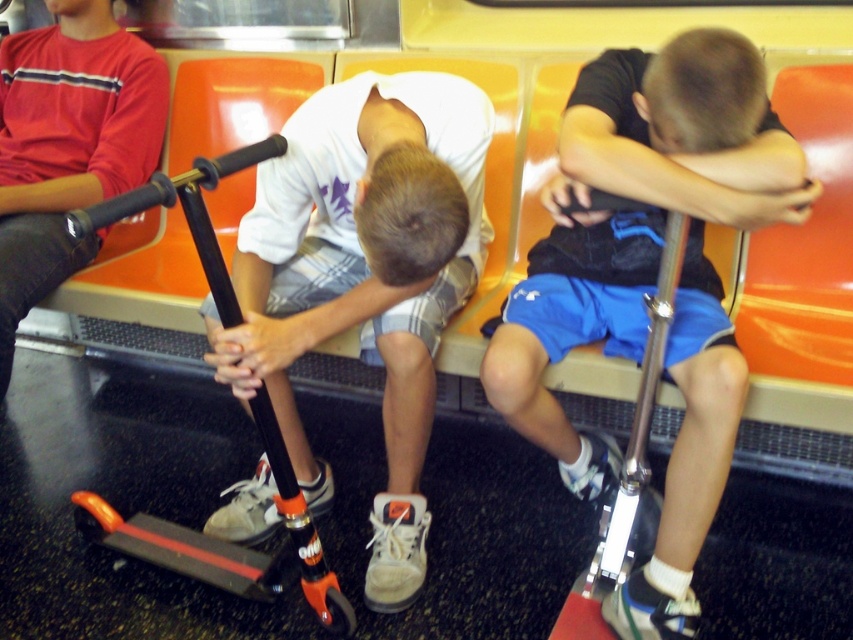
Question: Which object is the farthest from the orange matte scooter at center?

Choices:
 (A) white matte shirt at center
 (B) matte black scooter at center

Answer: (B)

Question: Is matte black scooter at center to the left of matte black scooter at lower left from the viewer's perspective?

Choices:
 (A) yes
 (B) no

Answer: (B)

Question: Is matte black scooter at center wider than white matte shirt at center?

Choices:
 (A) yes
 (B) no

Answer: (B)

Question: Is white matte shirt at center bigger than matte black scooter at lower left?

Choices:
 (A) no
 (B) yes

Answer: (B)

Question: Which of the following is the closest to the observer?

Choices:
 (A) orange matte scooter at center
 (B) matte black scooter at center
 (C) white matte shirt at center

Answer: (A)

Question: Which of the following is the closest to the observer?

Choices:
 (A) (631, 611)
 (B) (241, 564)
 (C) (55, 104)
 (D) (396, 544)

Answer: (A)